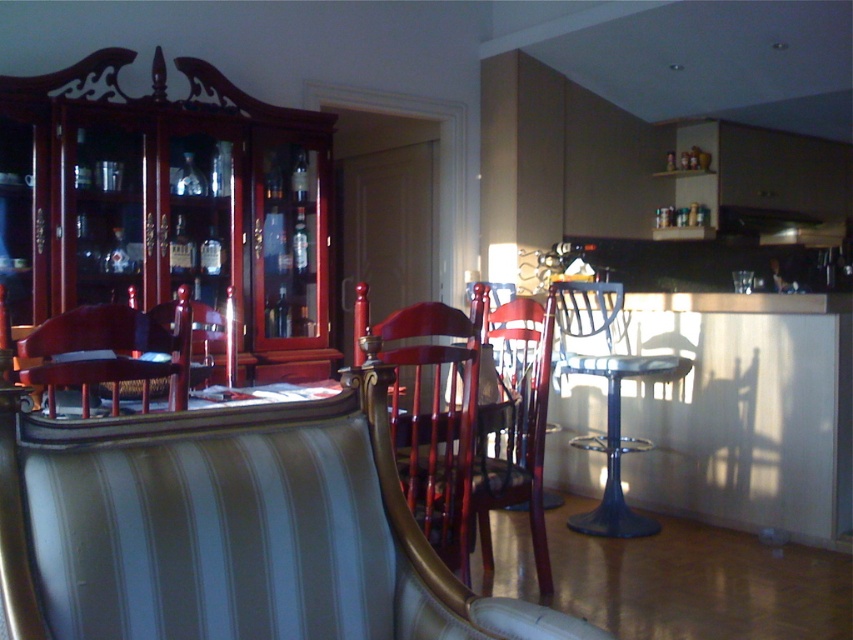
Question: Is matte wood chair at left to the left of metallic blue stool at right from the viewer's perspective?

Choices:
 (A) no
 (B) yes

Answer: (B)

Question: In this image, where is glossy wood chair at center located relative to matte wood chair at left?

Choices:
 (A) left
 (B) right

Answer: (B)

Question: Which object is the closest to the white striped leather armchair at center?

Choices:
 (A) metallic blue stool at right
 (B) matte wood chair at left

Answer: (B)

Question: Which of the following is the closest to the observer?

Choices:
 (A) (611, 420)
 (B) (380, 541)

Answer: (B)

Question: Among these points, which one is farthest from the camera?

Choices:
 (A) (24, 611)
 (B) (430, 365)

Answer: (B)

Question: Does white striped leather armchair at center appear over metallic blue stool at right?

Choices:
 (A) no
 (B) yes

Answer: (B)